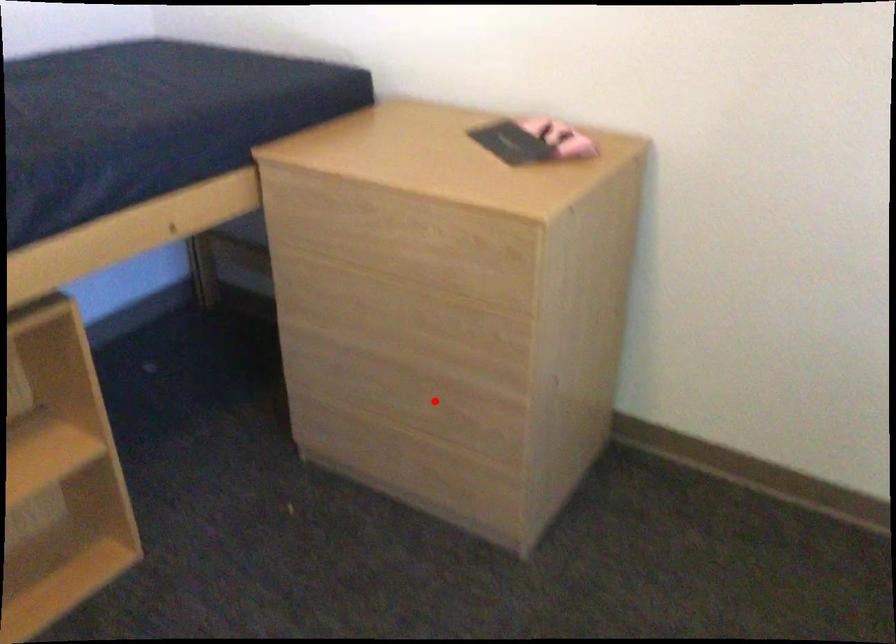
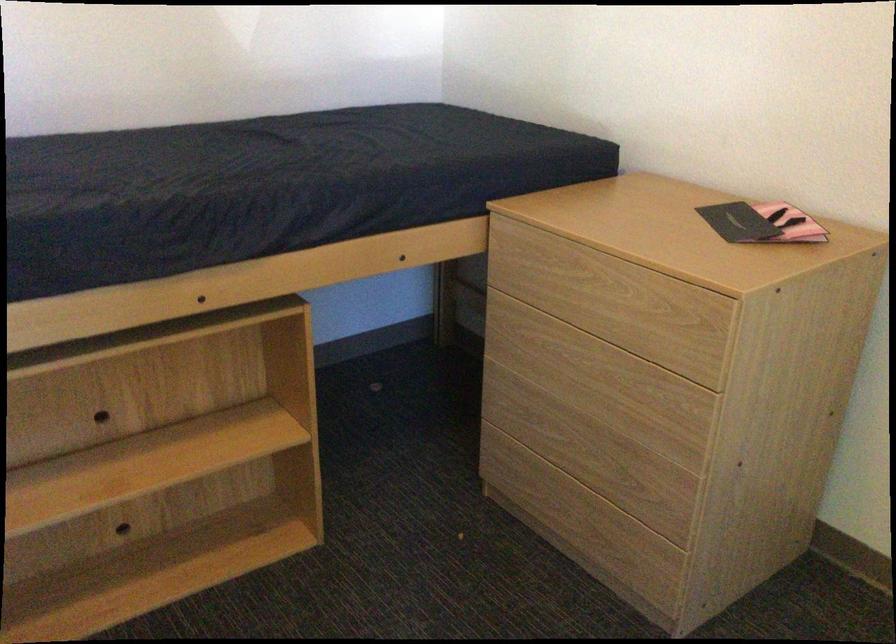
The point at the highlighted location is marked in the first image. Where is the corresponding point in the second image?

(607, 464)